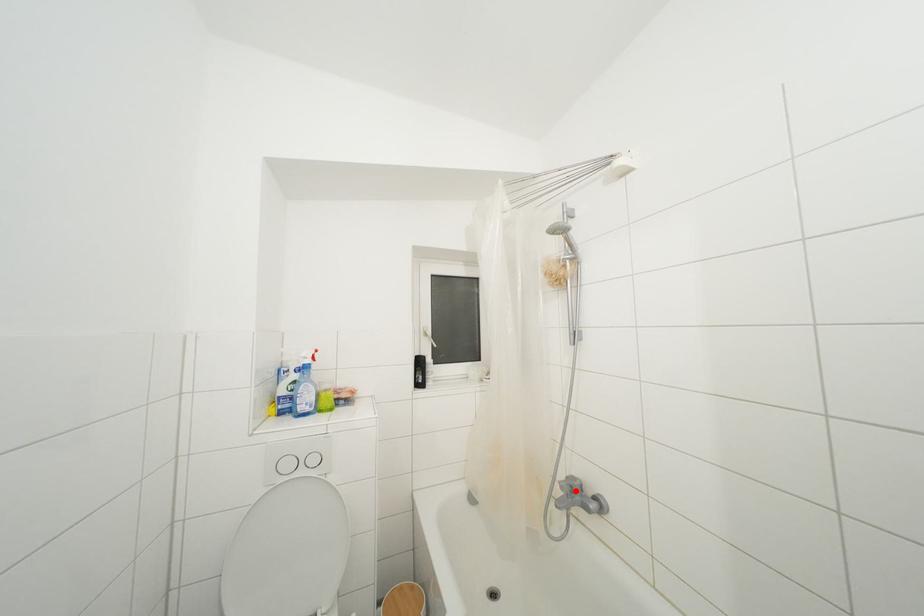
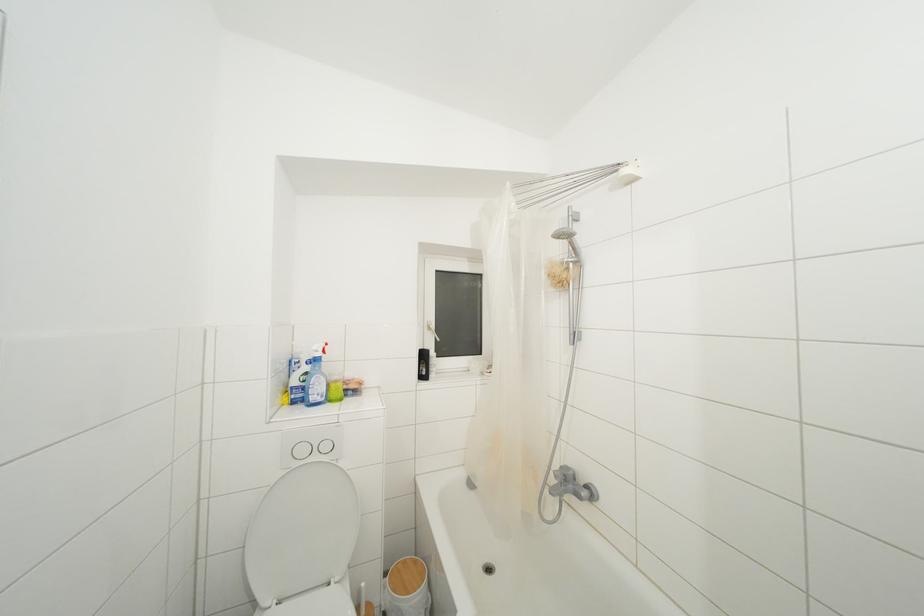
The point at the highlighted location is marked in the first image. Where is the corresponding point in the second image?

(568, 480)